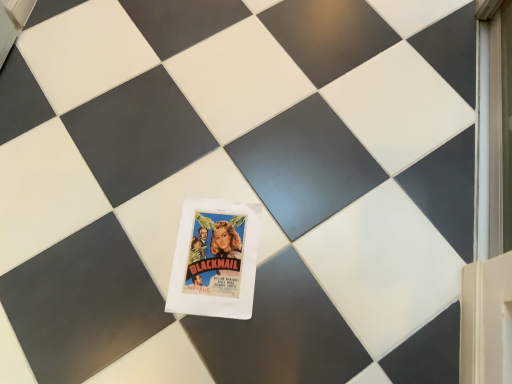
Identify the location of vacant space to the right of matte paper poster at center. (304, 255).